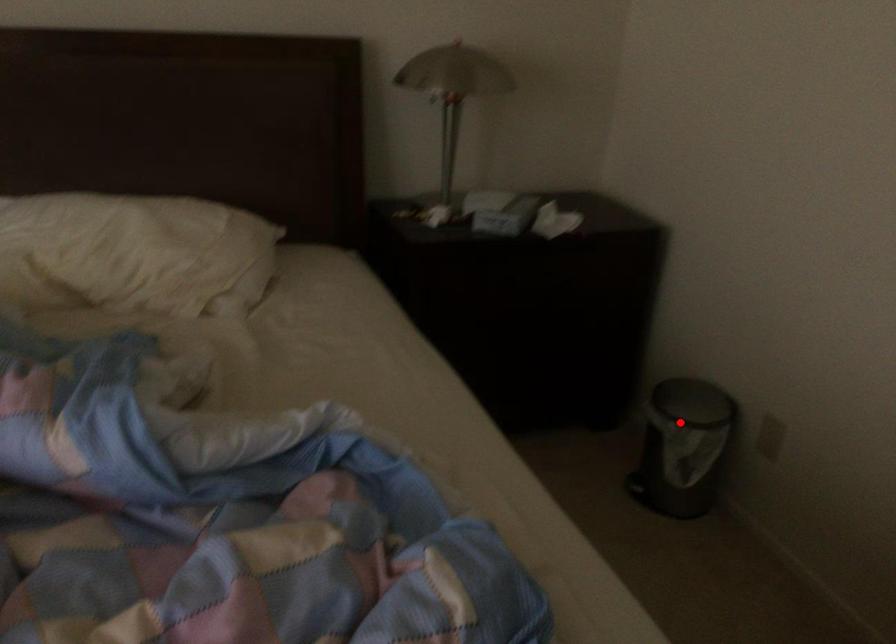
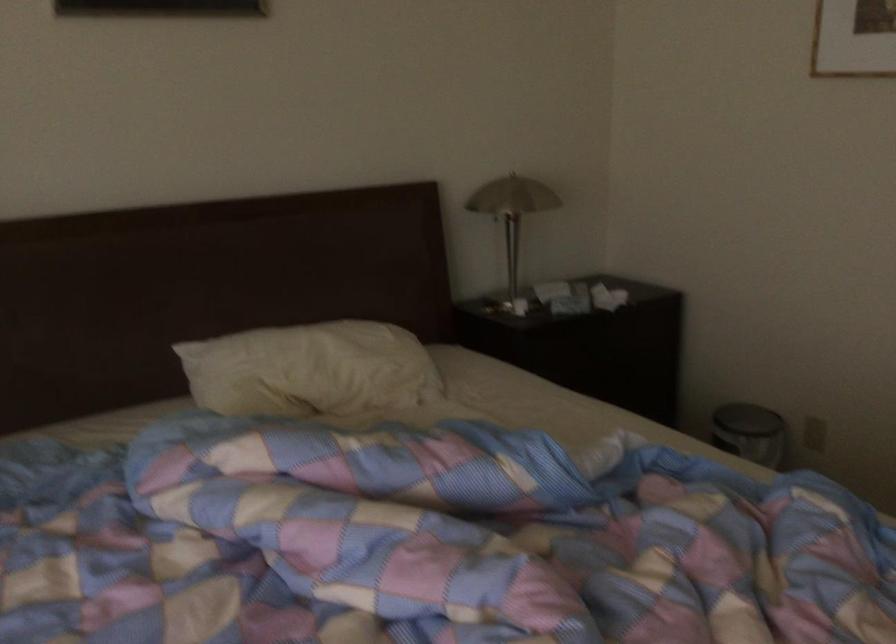
Find the pixel in the second image that matches the highlighted location in the first image.

(748, 431)